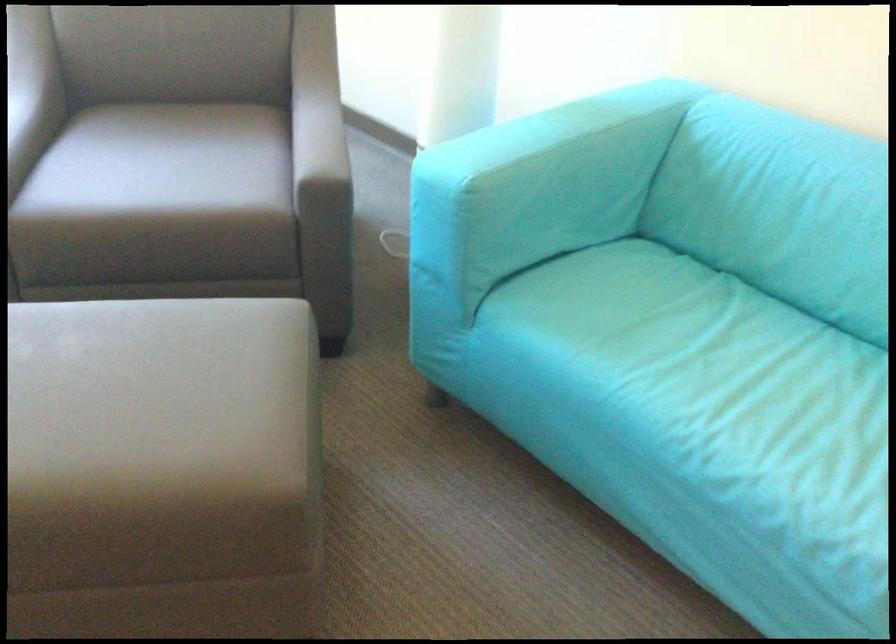
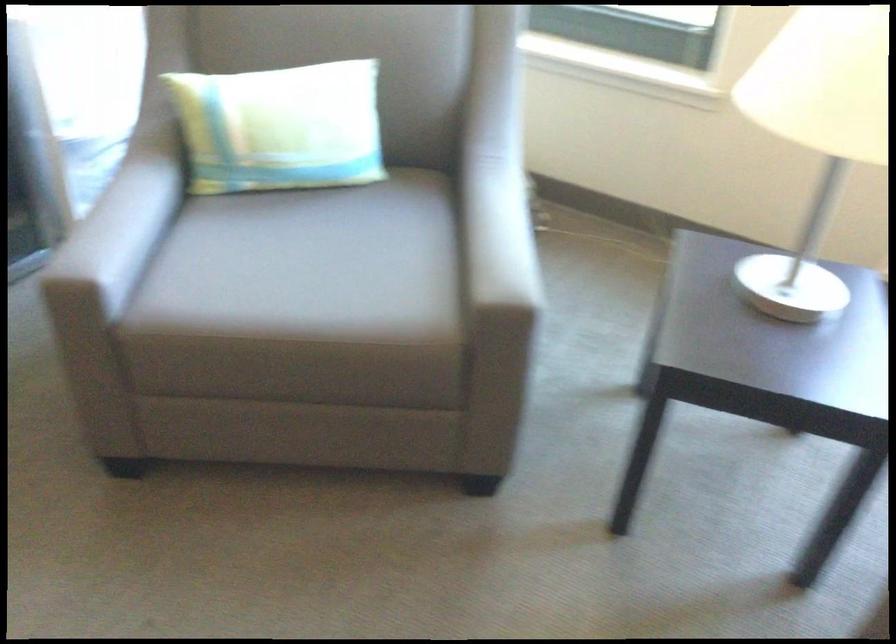
How did the camera likely rotate?

The camera's rotation is toward left-down.